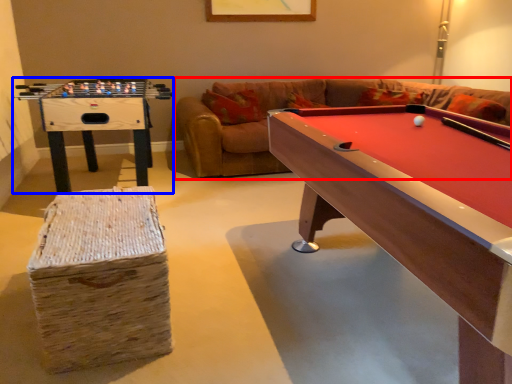
Question: Which point is closer to the camera, couch (highlighted by a red box) or table (highlighted by a blue box)?

Choices:
 (A) couch
 (B) table

Answer: (B)